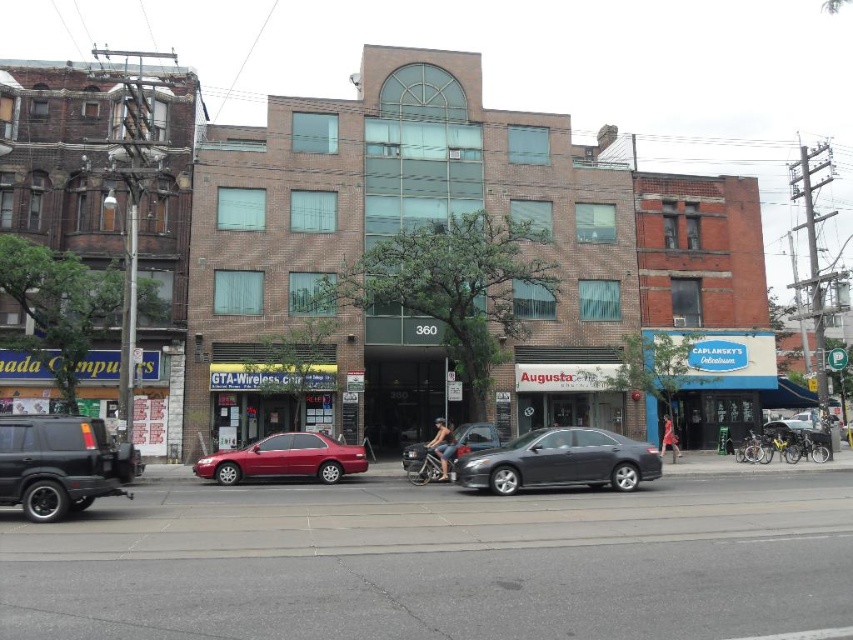
Question: Which point appears farthest from the camera in this image?

Choices:
 (A) (321, 452)
 (B) (474, 445)
 (C) (115, 451)
 (D) (544, 461)

Answer: (B)

Question: Which is nearer to the metallic silver car at center?

Choices:
 (A) satin black sedan at center
 (B) glossy red sedan at center

Answer: (B)

Question: Which point appears farthest from the camera in this image?

Choices:
 (A) (131, 476)
 (B) (496, 429)
 (C) (241, 474)
 (D) (587, 432)

Answer: (B)

Question: Is satin black sedan at center to the left of metallic silver car at center from the viewer's perspective?

Choices:
 (A) yes
 (B) no

Answer: (B)

Question: Is glossy red sedan at center further to camera compared to metallic silver car at center?

Choices:
 (A) yes
 (B) no

Answer: (B)

Question: Can you confirm if black matte suv at lower left is positioned below glossy red sedan at center?

Choices:
 (A) yes
 (B) no

Answer: (B)